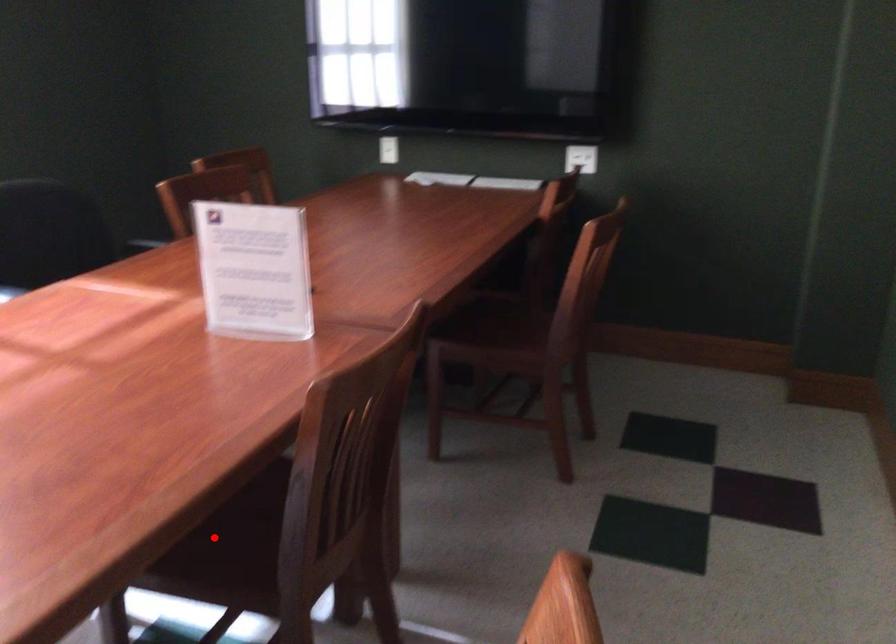
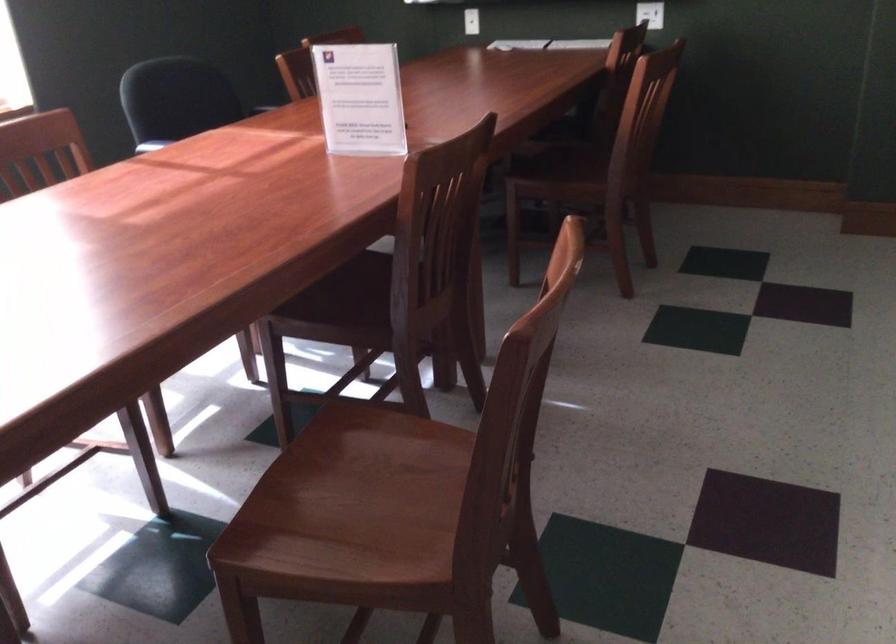
Question: I am providing you with two images of the same scene from different viewpoints. A red point is marked on the first image. At the location where the point appears in image 1, is it still visible in image 2?

Choices:
 (A) Yes
 (B) No

Answer: (A)